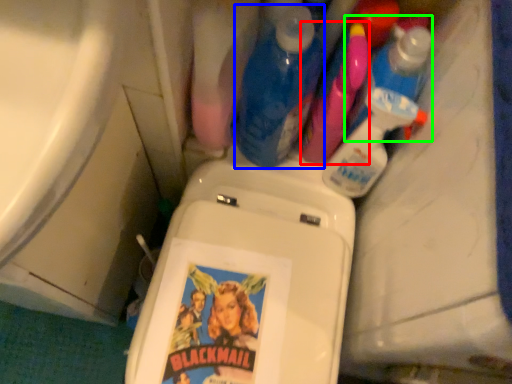
Question: Which is farther away from cleaning product (highlighted by a red box)? cleaning product (highlighted by a blue box) or cleaning product (highlighted by a green box)?

Choices:
 (A) cleaning product
 (B) cleaning product

Answer: (A)